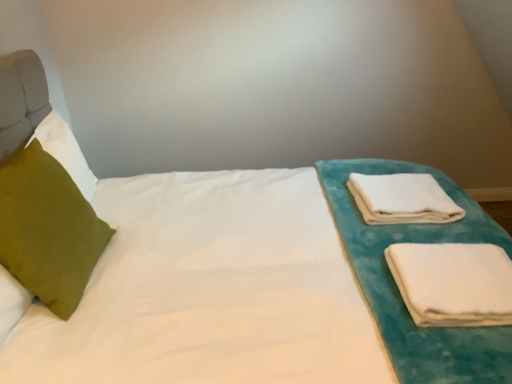
Question: Does white soft cloth at right, which is the first cloth in front-to-back order, have a lesser width compared to green velvet pillow at left?

Choices:
 (A) yes
 (B) no

Answer: (B)

Question: Does white soft cloth at right, marked as the second cloth in a back-to-front arrangement, have a greater height compared to green velvet pillow at left?

Choices:
 (A) no
 (B) yes

Answer: (A)

Question: From the image's perspective, is white soft cloth at right, which is the first cloth in front-to-back order, over green velvet pillow at left?

Choices:
 (A) no
 (B) yes

Answer: (A)

Question: Is white soft cloth at right, marked as the second cloth in a back-to-front arrangement, far away from green velvet pillow at left?

Choices:
 (A) yes
 (B) no

Answer: (A)

Question: Considering the relative positions of white soft cloth at right, which is the first cloth in front-to-back order, and green velvet pillow at left in the image provided, is white soft cloth at right, which is the first cloth in front-to-back order, to the left of green velvet pillow at left from the viewer's perspective?

Choices:
 (A) yes
 (B) no

Answer: (B)

Question: Is white soft towel at right, which is counted as the second cloth, starting from the bottom, to the left or to the right of white soft cloth at right, which is the first cloth in front-to-back order, in the image?

Choices:
 (A) right
 (B) left

Answer: (B)

Question: Is white soft towel at right, which ranks as the 1th cloth in top-to-bottom order, bigger or smaller than white soft cloth at right, marked as the second cloth in a back-to-front arrangement?

Choices:
 (A) big
 (B) small

Answer: (A)

Question: Considering the positions of white soft towel at right, which is the 1th cloth from back to front, and white soft cloth at right, which is the first cloth from bottom to top, in the image, is white soft towel at right, which is the 1th cloth from back to front, taller or shorter than white soft cloth at right, which is the first cloth from bottom to top,?

Choices:
 (A) tall
 (B) short

Answer: (A)

Question: Would you say white soft towel at right, which is counted as the second cloth, starting from the bottom, is inside or outside white soft cloth at right, marked as the second cloth in a back-to-front arrangement?

Choices:
 (A) outside
 (B) inside

Answer: (A)

Question: Is point (419, 190) positioned closer to the camera than point (57, 215)?

Choices:
 (A) closer
 (B) farther

Answer: (B)

Question: From a real-world perspective, is white soft towel at right, which is counted as the second cloth, starting from the bottom, physically located above or below green velvet pillow at left?

Choices:
 (A) below
 (B) above

Answer: (A)

Question: Relative to green velvet pillow at left, is white soft towel at right, which is the 1th cloth from back to front, in front or behind?

Choices:
 (A) front
 (B) behind

Answer: (B)

Question: Is white soft towel at right, the second cloth from the front, to the left or to the right of green velvet pillow at left in the image?

Choices:
 (A) left
 (B) right

Answer: (B)

Question: Is point (493, 253) positioned closer to the camera than point (394, 200)?

Choices:
 (A) farther
 (B) closer

Answer: (B)

Question: Looking at the image, does white soft cloth at right, which is the first cloth from bottom to top, seem bigger or smaller compared to white soft towel at right, which is the 1th cloth from back to front?

Choices:
 (A) small
 (B) big

Answer: (A)